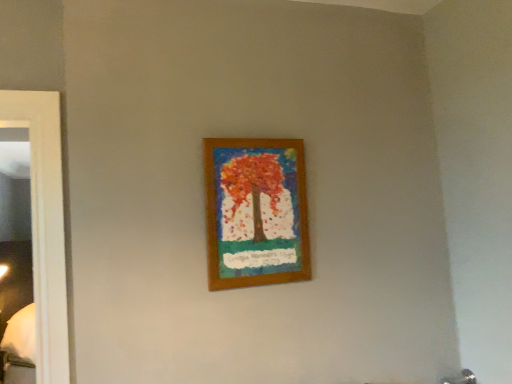
Measure the distance between wooden frame at center and camera.

They are 4.88 feet apart.

Image resolution: width=512 pixels, height=384 pixels. What do you see at coordinates (255, 212) in the screenshot?
I see `wooden frame at center` at bounding box center [255, 212].

The width and height of the screenshot is (512, 384). I want to click on wooden frame at center, so click(x=255, y=212).

Where is `wooden frame at center`? wooden frame at center is located at coordinates coord(255,212).